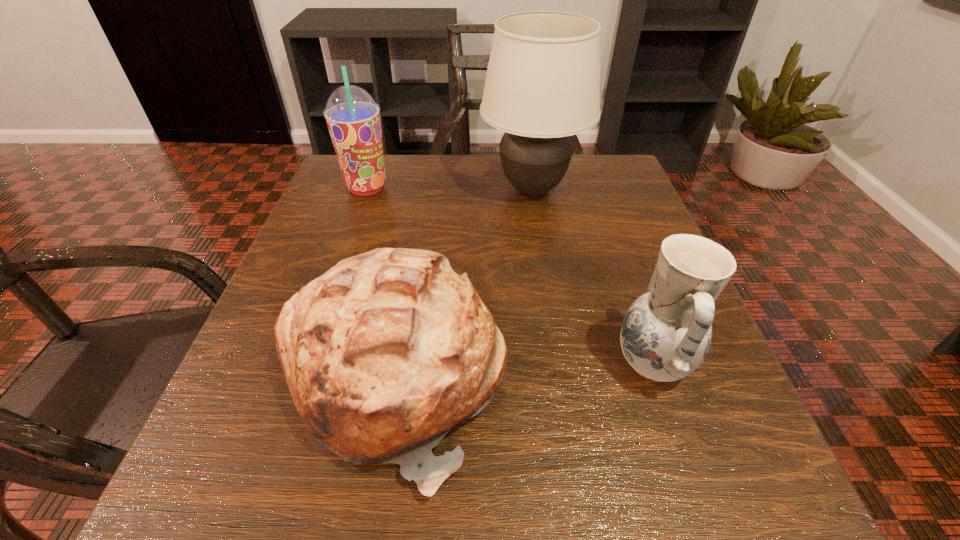
You are a GUI agent. You are given a task and a screenshot of the screen. Output one action in this format:
    pyautogui.click(x=<x>, y=<y>)
    Task: Click on the lampshade
    The height and width of the screenshot is (540, 960).
    Given the screenshot: What is the action you would take?
    pyautogui.click(x=542, y=86)

Image resolution: width=960 pixels, height=540 pixels. Find the location of `smoothie`. smoothie is located at coordinates (353, 118).

Identify the location of pottery. (666, 333).

Locate an element on the screen. This screenshot has width=960, height=540. the shortest object is located at coordinates click(x=386, y=352).

Locate an element on the screen. The height and width of the screenshot is (540, 960). free space located 0.210m on the front of the lampshade is located at coordinates (549, 292).

The image size is (960, 540). Identify the location of blank space located on the front of the second tallest object. (325, 308).

I want to click on vacant space located on either side of the pottery, so click(513, 363).

You are a GUI agent. You are given a task and a screenshot of the screen. Output one action in this format:
    pyautogui.click(x=<x>, y=<y>)
    Task: Click on the blank space located on either side of the pottery
    
    Given the screenshot: What is the action you would take?
    pyautogui.click(x=580, y=363)

Identify the location of vacant space located on either side of the pottery. (553, 363).

Where is `free point located on the back of the bread`? free point located on the back of the bread is located at coordinates (413, 272).